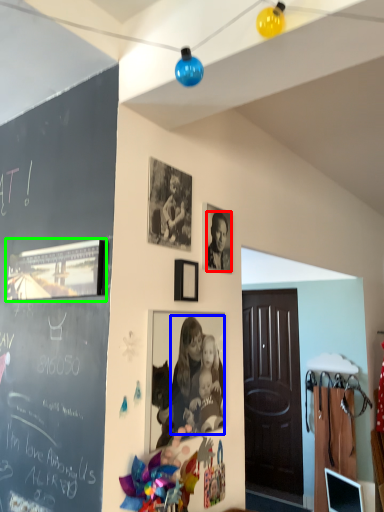
Question: Which object is positioned farthest from person (highlighted by a red box)? Select from person (highlighted by a blue box) and picture frame (highlighted by a green box).

Choices:
 (A) person
 (B) picture frame

Answer: (B)